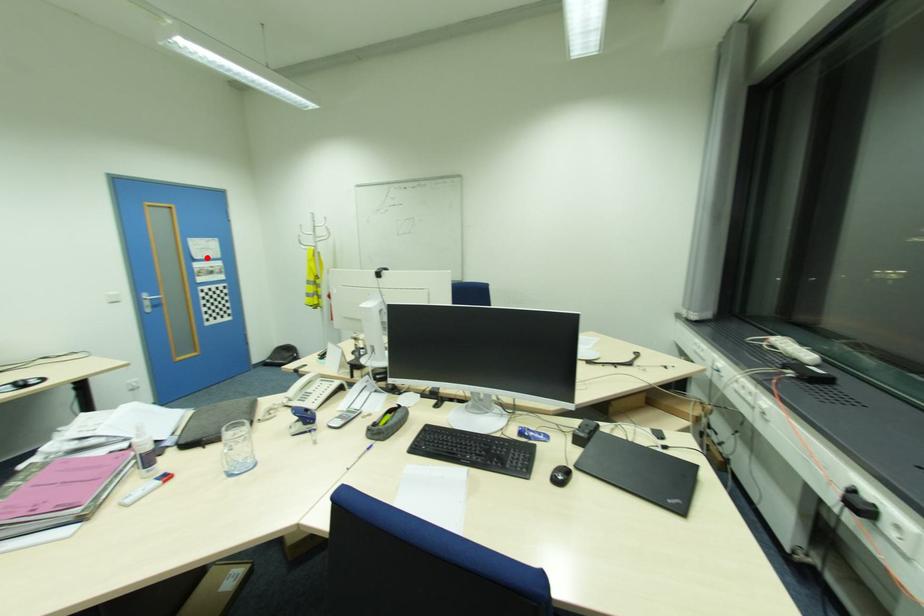
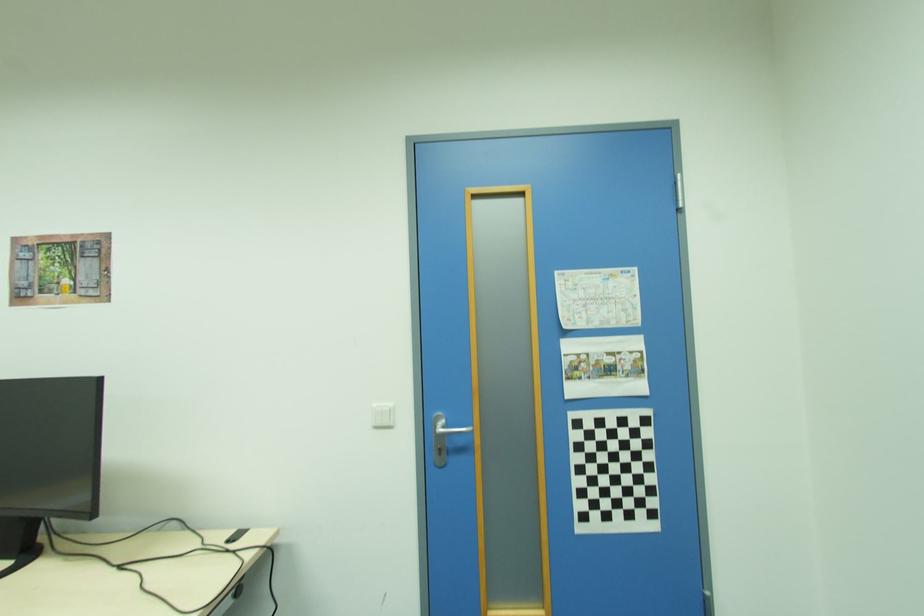
The point at the highlighted location is marked in the first image. Where is the corresponding point in the second image?

(599, 325)